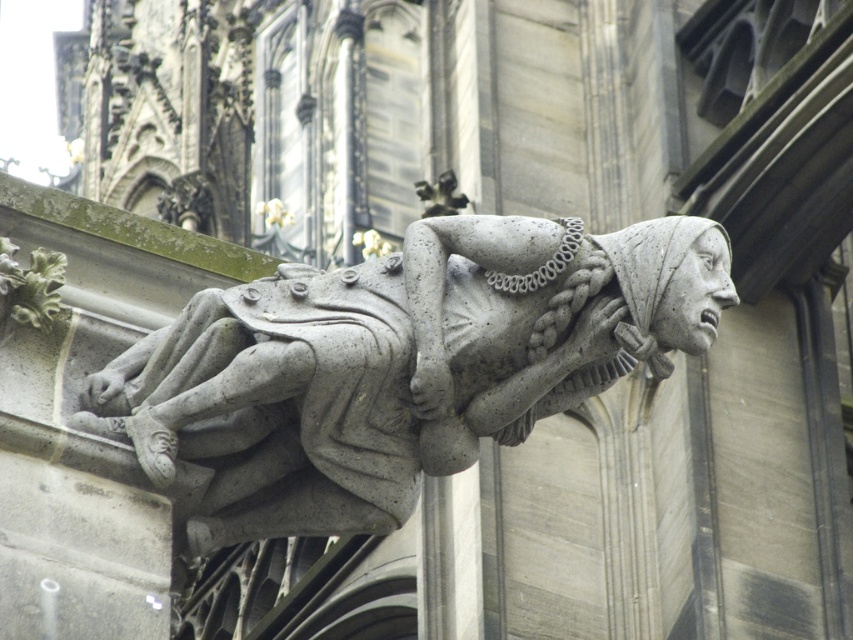
Does gray stone gargoyle at center have a lesser width compared to gray stone gargoyle at upper center?

Indeed, gray stone gargoyle at center has a lesser width compared to gray stone gargoyle at upper center.

Between gray stone gargoyle at center and gray stone gargoyle at upper center, which one appears on the left side from the viewer's perspective?

Positioned to the left is gray stone gargoyle at center.

Between point (256, 392) and point (440, 196), which one is positioned behind?

Point (440, 196)

Locate an element on the screen. gray stone gargoyle at center is located at coordinates (395, 371).

Does gray stone head at center have a larger size compared to gray stone gargoyle at upper center?

Actually, gray stone head at center might be smaller than gray stone gargoyle at upper center.

I want to click on gray stone head at center, so pyautogui.click(x=672, y=278).

Between point (656, 348) and point (688, 298), which one is positioned behind?

Positioned behind is point (656, 348).

Can you confirm if gray stone gargoyle at center is positioned to the left of gray stone head at center?

Correct, you'll find gray stone gargoyle at center to the left of gray stone head at center.

The width and height of the screenshot is (853, 640). What do you see at coordinates (395, 371) in the screenshot? I see `gray stone gargoyle at center` at bounding box center [395, 371].

Find the location of a particular element. This screenshot has width=853, height=640. gray stone gargoyle at center is located at coordinates (395, 371).